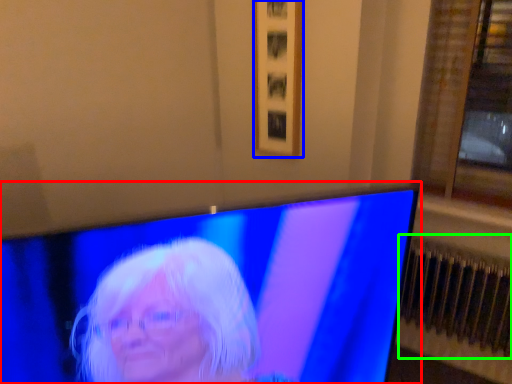
Question: Estimate the real-world distances between objects in this image. Which object is farther from television (highlighted by a red box), picture frame (highlighted by a blue box) or radiator (highlighted by a green box)?

Choices:
 (A) picture frame
 (B) radiator

Answer: (B)